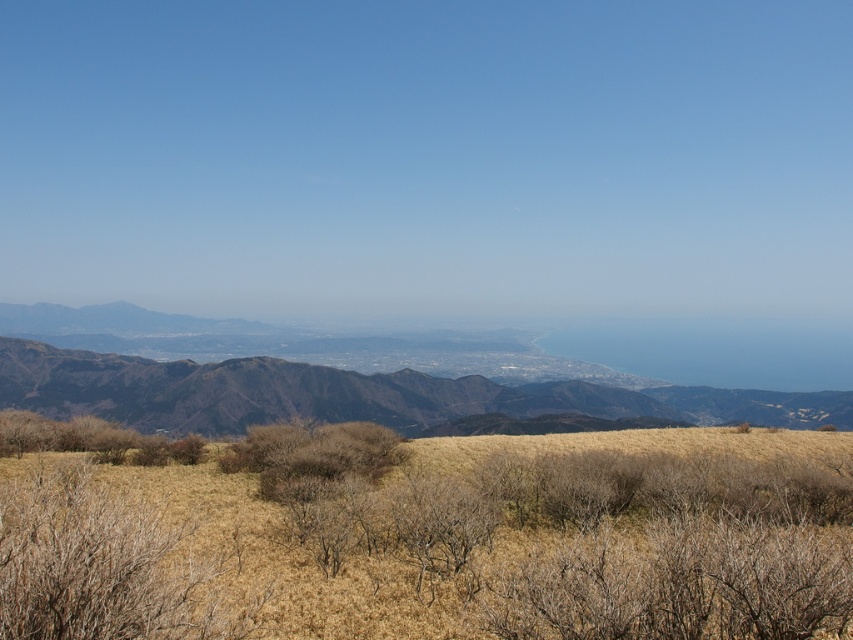
You are a GUI agent. You are given a task and a screenshot of the screen. Output one action in this format:
    pyautogui.click(x=<x>, y=<y>)
    Task: Click on the dry grass at center
    Image resolution: width=853 pixels, height=640 pixels.
    Given the screenshot: What is the action you would take?
    pyautogui.click(x=444, y=544)

Locate an element on the screen. Image resolution: width=853 pixels, height=640 pixels. dry grass at center is located at coordinates (444, 544).